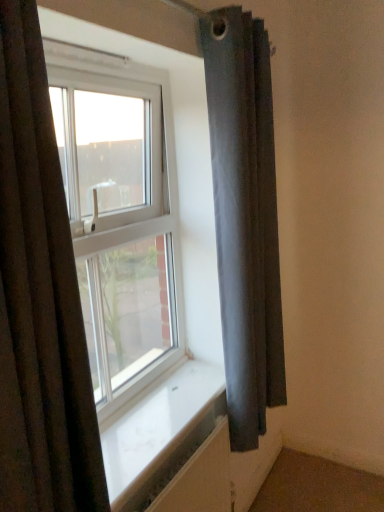
This screenshot has height=512, width=384. What do you see at coordinates (160, 432) in the screenshot?
I see `white smooth window sill at center` at bounding box center [160, 432].

Where is `transparent glass window at center`? Image resolution: width=384 pixels, height=512 pixels. transparent glass window at center is located at coordinates (120, 197).

At what (x,y) coordinates should I click in order to perform the action: click on dark gray fabric curtain at right, placed as the second curtain when sorted from left to right. Please return your answer as a coordinate pair (x, y). This screenshot has width=384, height=512. Looking at the image, I should click on (245, 217).

Where is `white smooth window sill at center`? white smooth window sill at center is located at coordinates (160, 432).

Consider the image. From a real-world perspective, is dark gray fabric curtain at right, the 1th curtain in the right-to-left sequence, over white smooth window sill at center?

Yes, from a real-world perspective, dark gray fabric curtain at right, the 1th curtain in the right-to-left sequence, is over white smooth window sill at center

Can you confirm if dark gray fabric curtain at right, placed as the second curtain when sorted from left to right, is positioned to the left of white smooth window sill at center?

No.

Could you tell me if dark gray fabric curtain at right, placed as the second curtain when sorted from left to right, is turned towards white smooth window sill at center?

No.

Is dark gray fabric curtain at right, which is the second curtain in front-to-back order, wider or thinner than white smooth window sill at center?

In the image, dark gray fabric curtain at right, which is the second curtain in front-to-back order, appears to be more narrow than white smooth window sill at center.

Based on their sizes in the image, would you say transparent glass window at center is bigger or smaller than white smooth window sill at center?

Considering their sizes, transparent glass window at center takes up more space than white smooth window sill at center.

Is transparent glass window at center taller than white smooth window sill at center?

Correct, transparent glass window at center is much taller as white smooth window sill at center.

Does point (178, 275) come farther from viewer compared to point (126, 501)?

That is True.

From the image's perspective, would you say transparent glass window at center is positioned over white smooth window sill at center?

Yes, from the image's perspective, transparent glass window at center is over white smooth window sill at center.

Considering the relative sizes of white smooth window sill at center and dark gray fabric curtain at right, placed as the first curtain when sorted from back to front, in the image provided, is white smooth window sill at center smaller than dark gray fabric curtain at right, placed as the first curtain when sorted from back to front,?

Indeed, white smooth window sill at center has a smaller size compared to dark gray fabric curtain at right, placed as the first curtain when sorted from back to front.

Can you tell me how much white smooth window sill at center and dark gray fabric curtain at right, placed as the first curtain when sorted from back to front, differ in facing direction?

The angle between the facing direction of white smooth window sill at center and the facing direction of dark gray fabric curtain at right, placed as the first curtain when sorted from back to front, is 0.00198 degrees.

Is white smooth window sill at center facing towards dark gray fabric curtain at right, placed as the second curtain when sorted from left to right?

No, white smooth window sill at center is not facing towards dark gray fabric curtain at right, placed as the second curtain when sorted from left to right.

Is point (196, 423) farther from viewer compared to point (210, 55)?

Yes, point (196, 423) is farther from viewer.

From a real-world perspective, is dark gray fabric curtain at right, placed as the second curtain when sorted from left to right, over dark fabric curtain at left, acting as the 1th curtain starting from the front?

Actually, dark gray fabric curtain at right, placed as the second curtain when sorted from left to right, is physically below dark fabric curtain at left, acting as the 1th curtain starting from the front, in the real world.

Which of these two, dark gray fabric curtain at right, placed as the second curtain when sorted from left to right, or dark fabric curtain at left, which is the 2th curtain from right to left, is wider?

dark fabric curtain at left, which is the 2th curtain from right to left.

Which is more to the right, dark gray fabric curtain at right, placed as the first curtain when sorted from back to front, or dark fabric curtain at left, acting as the 1th curtain starting from the front?

From the viewer's perspective, dark gray fabric curtain at right, placed as the first curtain when sorted from back to front, appears more on the right side.

At what (x,y) coordinates should I click in order to perform the action: click on curtain lying behind the transparent glass window at center. Please return your answer as a coordinate pair (x, y). Image resolution: width=384 pixels, height=512 pixels. Looking at the image, I should click on (245, 217).

How distant is transparent glass window at center from dark gray fabric curtain at right, placed as the first curtain when sorted from back to front?

transparent glass window at center is 12.33 inches from dark gray fabric curtain at right, placed as the first curtain when sorted from back to front.

Based on the photo, visually, is transparent glass window at center positioned to the left or to the right of dark gray fabric curtain at right, which is the second curtain in front-to-back order?

transparent glass window at center is to the left of dark gray fabric curtain at right, which is the second curtain in front-to-back order.

Could you tell me if transparent glass window at center is facing dark gray fabric curtain at right, placed as the second curtain when sorted from left to right?

Yes, transparent glass window at center is oriented towards dark gray fabric curtain at right, placed as the second curtain when sorted from left to right.

Considering the relative sizes of white smooth window sill at center and dark fabric curtain at left, which is the 2th curtain from right to left, in the image provided, is white smooth window sill at center taller than dark fabric curtain at left, which is the 2th curtain from right to left,?

Incorrect, the height of white smooth window sill at center is not larger of that of dark fabric curtain at left, which is the 2th curtain from right to left.

Is the position of white smooth window sill at center less distant than that of dark fabric curtain at left, acting as the 1th curtain starting from the front?

No, it is not.

Is white smooth window sill at center in contact with dark fabric curtain at left, the second curtain from the back?

white smooth window sill at center and dark fabric curtain at left, the second curtain from the back, are clearly separated.

From the image's perspective, is white smooth window sill at center on dark fabric curtain at left, which is the 2th curtain from right to left?

No, from the image's perspective, white smooth window sill at center is not over dark fabric curtain at left, which is the 2th curtain from right to left.

Is point (53, 189) behind point (223, 88)?

No, (53, 189) is in front of (223, 88).

In terms of width, does dark fabric curtain at left, which is the 2th curtain from right to left, look wider or thinner when compared to dark gray fabric curtain at right, which is the second curtain in front-to-back order?

dark fabric curtain at left, which is the 2th curtain from right to left, is wider than dark gray fabric curtain at right, which is the second curtain in front-to-back order.

Based on the photo, from the image's perspective, between dark fabric curtain at left, acting as the 1th curtain starting from the front, and dark gray fabric curtain at right, placed as the second curtain when sorted from left to right, which one is located above?

dark gray fabric curtain at right, placed as the second curtain when sorted from left to right, from the image's perspective.

Measure the distance between dark fabric curtain at left, the second curtain from the back, and dark gray fabric curtain at right, placed as the second curtain when sorted from left to right.

A distance of 30.61 inches exists between dark fabric curtain at left, the second curtain from the back, and dark gray fabric curtain at right, placed as the second curtain when sorted from left to right.

From the image's perspective, which curtain is the 2nd one above the white smooth window sill at center? Please provide its 2D coordinates.

[(245, 217)]

This screenshot has width=384, height=512. I want to click on window positioned vertically above the white smooth window sill at center (from a real-world perspective), so click(x=120, y=197).

Considering their positions, is dark fabric curtain at left, acting as the 1th curtain starting from the front, positioned closer to transparent glass window at center than white smooth window sill at center?

The object closer to transparent glass window at center is white smooth window sill at center.

When comparing their distances from white smooth window sill at center, does transparent glass window at center or dark fabric curtain at left, the 1th curtain in the left-to-right sequence, seem further?

dark fabric curtain at left, the 1th curtain in the left-to-right sequence.

Looking at the image, which one is located closer to dark fabric curtain at left, which is the 2th curtain from right to left, transparent glass window at center or dark gray fabric curtain at right, which is the second curtain in front-to-back order?

Based on the image, transparent glass window at center appears to be nearer to dark fabric curtain at left, which is the 2th curtain from right to left.

When comparing their distances from dark fabric curtain at left, the second curtain from the back, does white smooth window sill at center or dark gray fabric curtain at right, which is the second curtain in front-to-back order, seem further?

dark gray fabric curtain at right, which is the second curtain in front-to-back order, is positioned further to the anchor dark fabric curtain at left, the second curtain from the back.

From the image, which object appears to be farther from dark fabric curtain at left, the 1th curtain in the left-to-right sequence, dark gray fabric curtain at right, placed as the first curtain when sorted from back to front, or white smooth window sill at center?

dark gray fabric curtain at right, placed as the first curtain when sorted from back to front.

When comparing their distances from dark gray fabric curtain at right, placed as the first curtain when sorted from back to front, does transparent glass window at center or dark fabric curtain at left, the 1th curtain in the left-to-right sequence, seem closer?

The object closer to dark gray fabric curtain at right, placed as the first curtain when sorted from back to front, is transparent glass window at center.

Estimate the real-world distances between objects in this image. Which object is further from dark gray fabric curtain at right, placed as the second curtain when sorted from left to right, transparent glass window at center or white smooth window sill at center?

The object further to dark gray fabric curtain at right, placed as the second curtain when sorted from left to right, is white smooth window sill at center.

Estimate the real-world distances between objects in this image. Which object is closer to dark gray fabric curtain at right, the 1th curtain in the right-to-left sequence, white smooth window sill at center or transparent glass window at center?

Based on the image, transparent glass window at center appears to be nearer to dark gray fabric curtain at right, the 1th curtain in the right-to-left sequence.

Find the location of `window sill between dark fabric curtain at left, acting as the 1th curtain starting from the front, and dark gray fabric curtain at right, the 1th curtain in the right-to-left sequence, in the front-back direction`. window sill between dark fabric curtain at left, acting as the 1th curtain starting from the front, and dark gray fabric curtain at right, the 1th curtain in the right-to-left sequence, in the front-back direction is located at coordinates (160, 432).

Identify the location of window sill between dark fabric curtain at left, which is the 2th curtain from right to left, and transparent glass window at center from front to back. Image resolution: width=384 pixels, height=512 pixels. (x=160, y=432).

Image resolution: width=384 pixels, height=512 pixels. Identify the location of window positioned between dark fabric curtain at left, acting as the 1th curtain starting from the front, and dark gray fabric curtain at right, which is the second curtain in front-to-back order, from near to far. (120, 197).